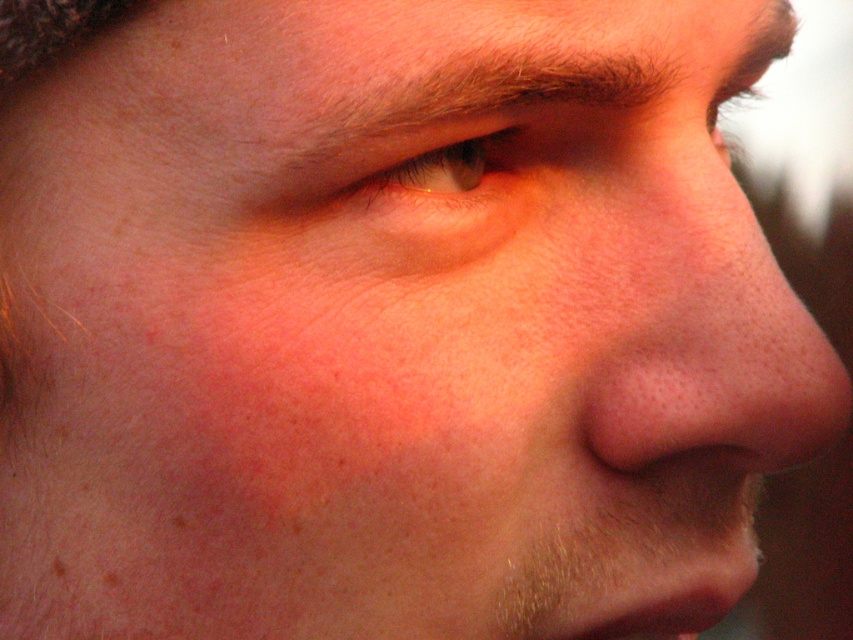
Question: Which point appears farthest from the camera in this image?

Choices:
 (A) (486, 180)
 (B) (741, 240)

Answer: (B)

Question: Does pink smooth skin at center appear under green matte eye at upper center?

Choices:
 (A) no
 (B) yes

Answer: (B)

Question: Does pink smooth skin at center appear on the left side of green matte eye at upper center?

Choices:
 (A) no
 (B) yes

Answer: (A)

Question: From the image, what is the correct spatial relationship of pink smooth skin at center in relation to green matte eye at upper center?

Choices:
 (A) below
 (B) above

Answer: (A)